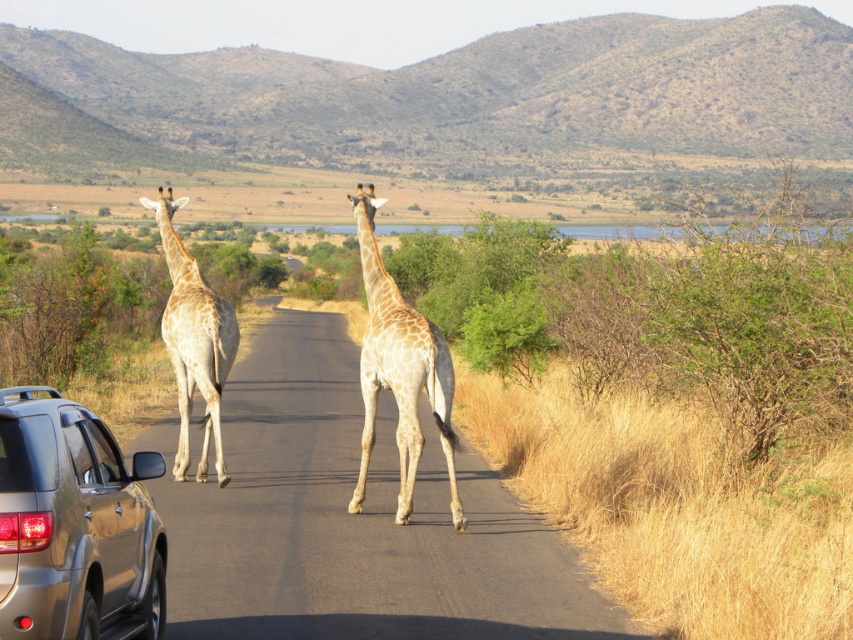
Question: Can you confirm if satin silver car at lower left is positioned below light brown textured giraffe at center?

Choices:
 (A) yes
 (B) no

Answer: (A)

Question: Which of the following is the farthest from the observer?

Choices:
 (A) satin silver car at lower left
 (B) light brown textured giraffe at center
 (C) light brown spotted giraffe at center

Answer: (B)

Question: Does satin silver car at lower left appear on the left side of light brown textured giraffe at center?

Choices:
 (A) yes
 (B) no

Answer: (B)

Question: Which of the following is the farthest from the observer?

Choices:
 (A) (88, 556)
 (B) (223, 352)

Answer: (B)

Question: Can you confirm if light brown spotted giraffe at center is wider than light brown textured giraffe at center?

Choices:
 (A) yes
 (B) no

Answer: (B)

Question: Which of these objects is positioned closest to the light brown spotted giraffe at center?

Choices:
 (A) satin silver car at lower left
 (B) light brown textured giraffe at center

Answer: (B)